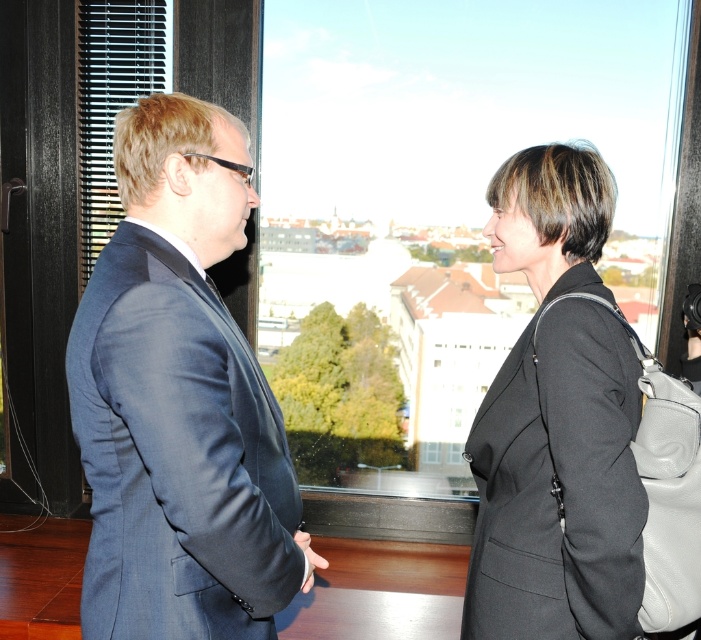
Question: Is dark blue suit at left below matte black coat at right?

Choices:
 (A) yes
 (B) no

Answer: (B)

Question: Is dark blue suit at left further to the viewer compared to matte black coat at right?

Choices:
 (A) yes
 (B) no

Answer: (B)

Question: Does dark blue suit at left have a lesser width compared to matte black coat at right?

Choices:
 (A) no
 (B) yes

Answer: (A)

Question: Which point is closer to the camera?

Choices:
 (A) (590, 604)
 (B) (156, 336)

Answer: (B)